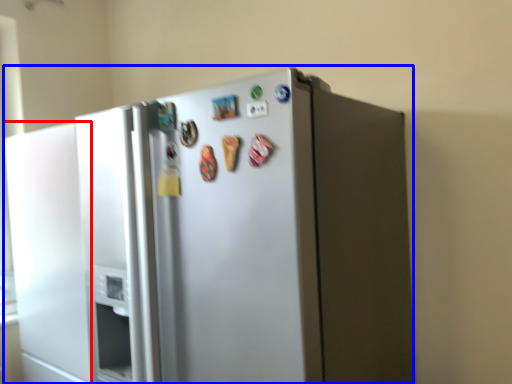
Question: Which of the following is the farthest to the observer, door (highlighted by a red box) or refrigerator (highlighted by a blue box)?

Choices:
 (A) door
 (B) refrigerator

Answer: (A)